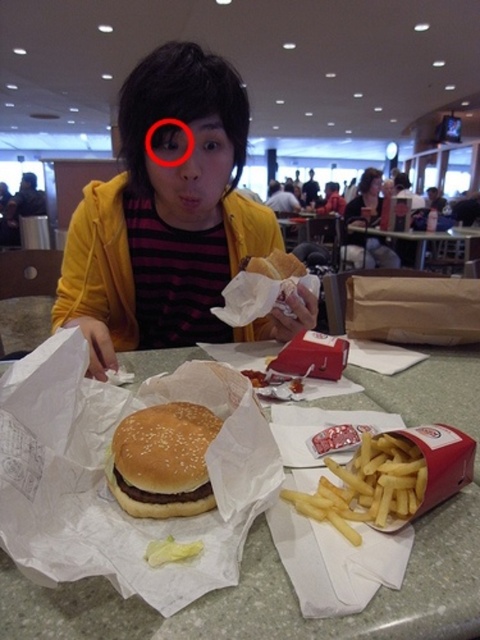
What are the coordinates of the yellow matte jacket at center?

The coordinates of the yellow matte jacket at center are at point (169,220).

You are a delivery person trying to locate the yellow matte jacket at center in the image. The coordinates given are point (169, 220). If the image is divided into a grid from 0 to 1 on both axes, where would you look to find the yellow matte jacket at center?

The yellow matte jacket at center is located at the coordinates point (169, 220), which is in the lower left quadrant of the image grid.